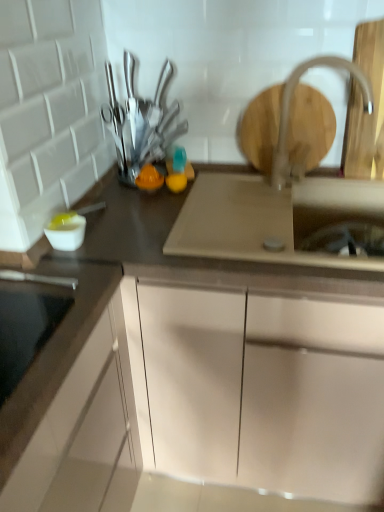
Question: From a real-world perspective, is satin nickel faucet at upper right located beneath satin silver sink at center?

Choices:
 (A) no
 (B) yes

Answer: (A)

Question: Considering the relative positions of satin nickel faucet at upper right and satin silver sink at center in the image provided, is satin nickel faucet at upper right in front of satin silver sink at center?

Choices:
 (A) yes
 (B) no

Answer: (B)

Question: Can you confirm if satin nickel faucet at upper right is positioned to the left of satin silver sink at center?

Choices:
 (A) yes
 (B) no

Answer: (B)

Question: Is satin nickel faucet at upper right behind satin silver sink at center?

Choices:
 (A) yes
 (B) no

Answer: (A)

Question: From the image's perspective, is satin nickel faucet at upper right beneath satin silver sink at center?

Choices:
 (A) yes
 (B) no

Answer: (B)

Question: Can you confirm if satin nickel faucet at upper right is bigger than satin silver sink at center?

Choices:
 (A) yes
 (B) no

Answer: (B)

Question: Considering the relative sizes of metallic silver knives at upper center and satin silver sink at center in the image provided, is metallic silver knives at upper center wider than satin silver sink at center?

Choices:
 (A) no
 (B) yes

Answer: (A)

Question: Can you confirm if metallic silver knives at upper center is positioned to the left of satin silver sink at center?

Choices:
 (A) no
 (B) yes

Answer: (B)

Question: Is metallic silver knives at upper center facing away from satin silver sink at center?

Choices:
 (A) no
 (B) yes

Answer: (A)

Question: Can you confirm if metallic silver knives at upper center is shorter than satin silver sink at center?

Choices:
 (A) no
 (B) yes

Answer: (A)

Question: From the image's perspective, is metallic silver knives at upper center below satin silver sink at center?

Choices:
 (A) no
 (B) yes

Answer: (A)

Question: From the image's perspective, is metallic silver knives at upper center on top of satin silver sink at center?

Choices:
 (A) no
 (B) yes

Answer: (B)

Question: Is metallic silver knives at upper center not inside white matte cabinet at center?

Choices:
 (A) no
 (B) yes

Answer: (B)